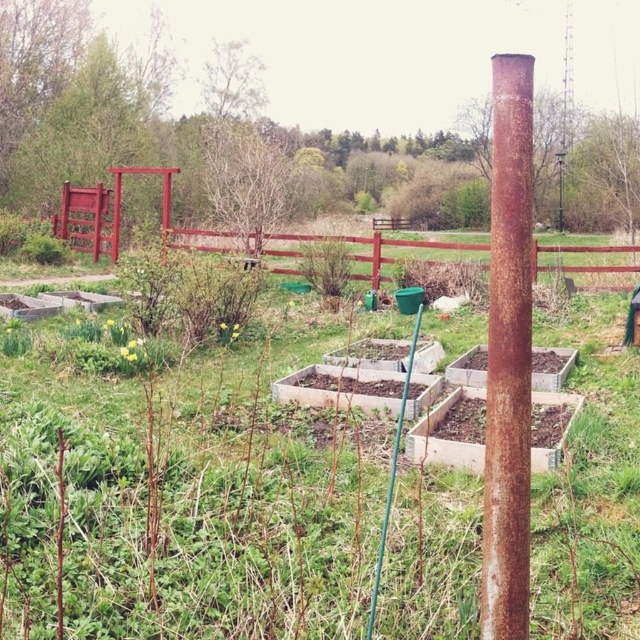
Question: Which point appears farthest from the camera in this image?

Choices:
 (A) (512, 266)
 (B) (621, 273)

Answer: (B)

Question: Does rusty metal pole at center appear on the left side of rustic wooden fence at center?

Choices:
 (A) no
 (B) yes

Answer: (B)

Question: Among these points, which one is nearest to the camera?

Choices:
 (A) (518, 362)
 (B) (371, 246)

Answer: (A)

Question: Does rusty metal pole at center lie in front of rustic wooden fence at center?

Choices:
 (A) yes
 (B) no

Answer: (A)

Question: Is rusty metal pole at center further to the viewer compared to rustic wooden fence at center?

Choices:
 (A) no
 (B) yes

Answer: (A)